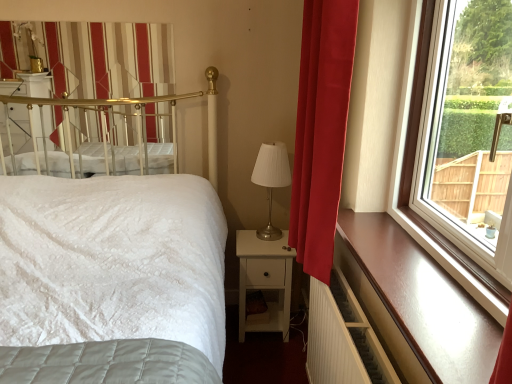
The height and width of the screenshot is (384, 512). I want to click on free space above gold metallic canopy bed at upper left (from a real-world perspective), so click(x=67, y=20).